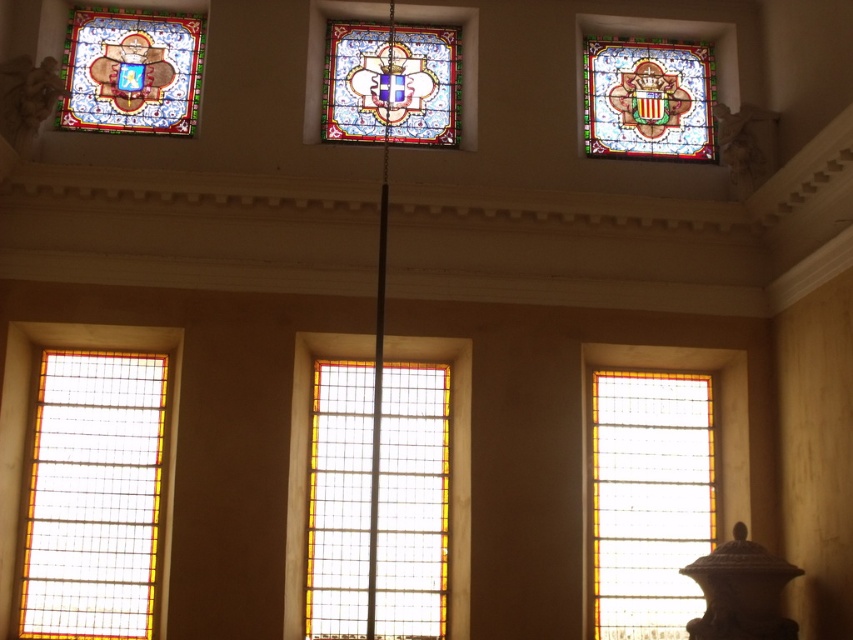
Question: Is clear glass window at center to the left of stained glass at upper left from the viewer's perspective?

Choices:
 (A) no
 (B) yes

Answer: (A)

Question: Does clear glass window at lower left have a lesser width compared to stained glass at upper left?

Choices:
 (A) yes
 (B) no

Answer: (A)

Question: Observing the image, what is the correct spatial positioning of clear glass window at lower right in reference to stained glass at upper left?

Choices:
 (A) above
 (B) below

Answer: (B)

Question: Which object is positioned farthest from the clear glass window at center?

Choices:
 (A) clear glass window at lower left
 (B) stained glass window at center

Answer: (B)

Question: Estimate the real-world distances between objects in this image. Which object is farther from the stained glass at upper left?

Choices:
 (A) clear glass window at lower right
 (B) clear glass window at lower left

Answer: (A)

Question: Which object is positioned farthest from the stained glass window at center?

Choices:
 (A) clear glass window at lower right
 (B) clear glass window at center
 (C) stained glass at upper left
 (D) clear glass window at lower left

Answer: (D)